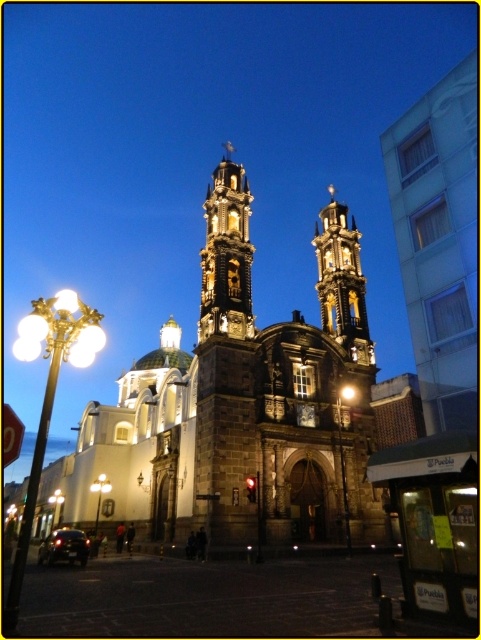
Question: Is golden ornate bell tower at center smaller than dark gray stone bell tower at center?

Choices:
 (A) yes
 (B) no

Answer: (A)

Question: Is golden ornate bell tower at center thinner than dark gray stone bell tower at center?

Choices:
 (A) no
 (B) yes

Answer: (B)

Question: Which point appears closest to the camera in this image?

Choices:
 (A) (350, 326)
 (B) (220, 285)

Answer: (B)

Question: Can you confirm if golden ornate bell tower at center is bigger than dark gray stone bell tower at center?

Choices:
 (A) yes
 (B) no

Answer: (B)